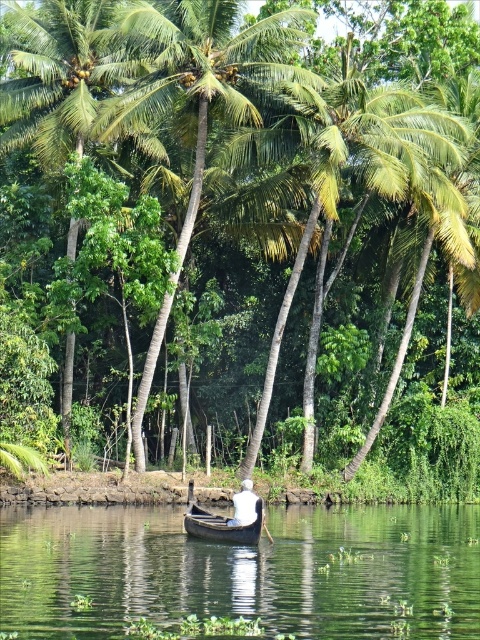
The image size is (480, 640). Describe the element at coordinates (242, 572) in the screenshot. I see `green smooth water at center` at that location.

Does green smooth water at center have a smaller size compared to black wood boat at center?

No.

Does point (49, 580) lie behind point (249, 518)?

No.

Locate an element on the screen. green smooth water at center is located at coordinates (242, 572).

Does black wood boat at center have a lesser width compared to white fabric at center?

Yes.

Which is more to the right, black wood boat at center or white fabric at center?

black wood boat at center

At what (x,y) coordinates should I click in order to perform the action: click on black wood boat at center. Please return your answer as a coordinate pair (x, y). Looking at the image, I should click on (228, 518).

Identify the location of black wood boat at center. The width and height of the screenshot is (480, 640). (228, 518).

Between green smooth water at center and white fabric at center, which one has less height?

Standing shorter between the two is green smooth water at center.

How distant is green smooth water at center from white fabric at center?

green smooth water at center is 6.28 meters away from white fabric at center.

At what (x,y) coordinates should I click in order to perform the action: click on green smooth water at center. Please return your answer as a coordinate pair (x, y). The image size is (480, 640). Looking at the image, I should click on (242, 572).